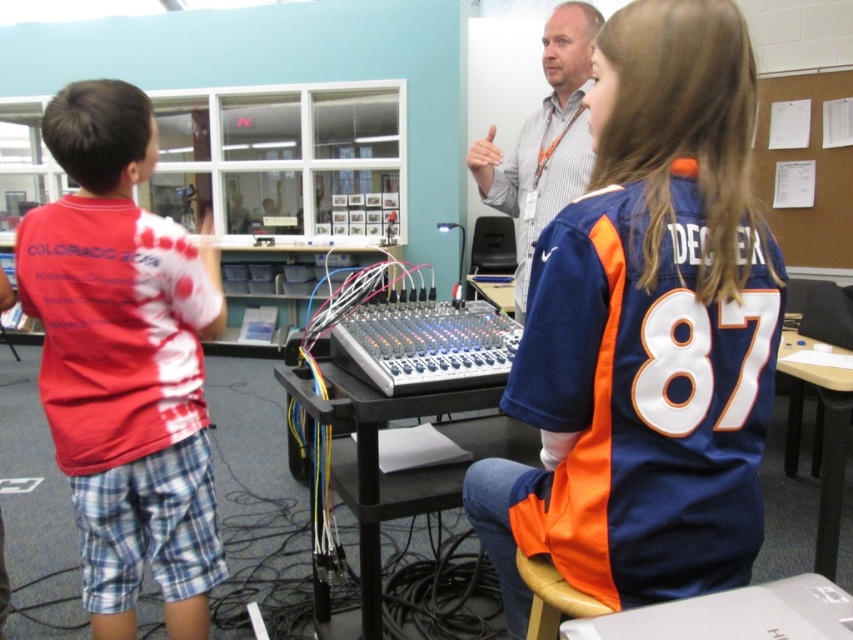
You are standing at the point with coordinates point (579,166) and want to move to the door located at point (120,288). Can you walk directly to the door without moving around any obstacles?

Point (120,288) is in front of point (579,166), so yes, you can walk directly to the door located at point (120,288) without moving around any obstacles since it is closer to you.